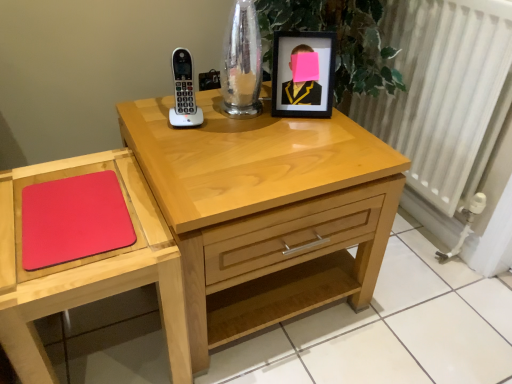
You are a GUI agent. You are given a task and a screenshot of the screen. Output one action in this format:
    pyautogui.click(x=<x>, y=<y>)
    Task: Click on the unoccupied area in front of white plastic phone at upper center
    The image size is (512, 384).
    Given the screenshot: What is the action you would take?
    pyautogui.click(x=188, y=150)